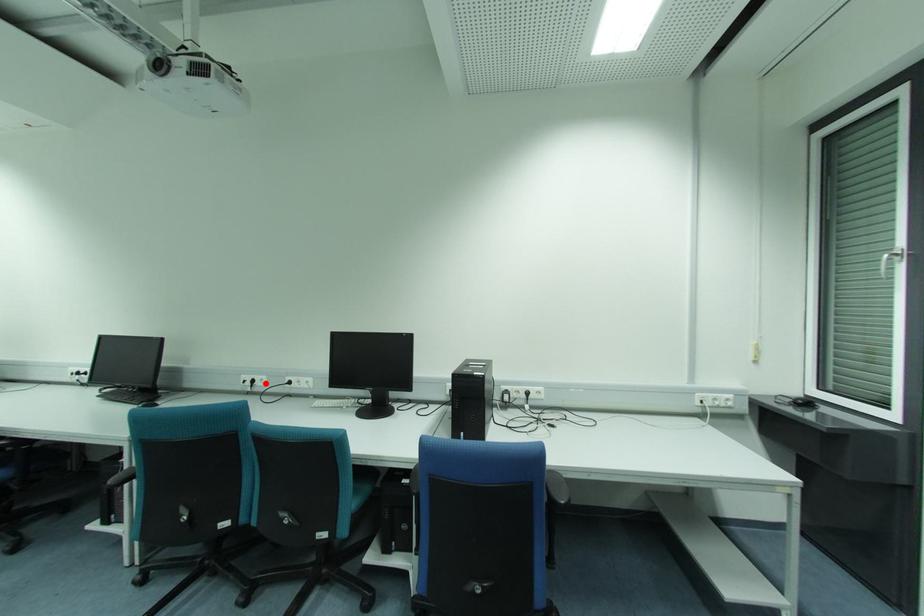
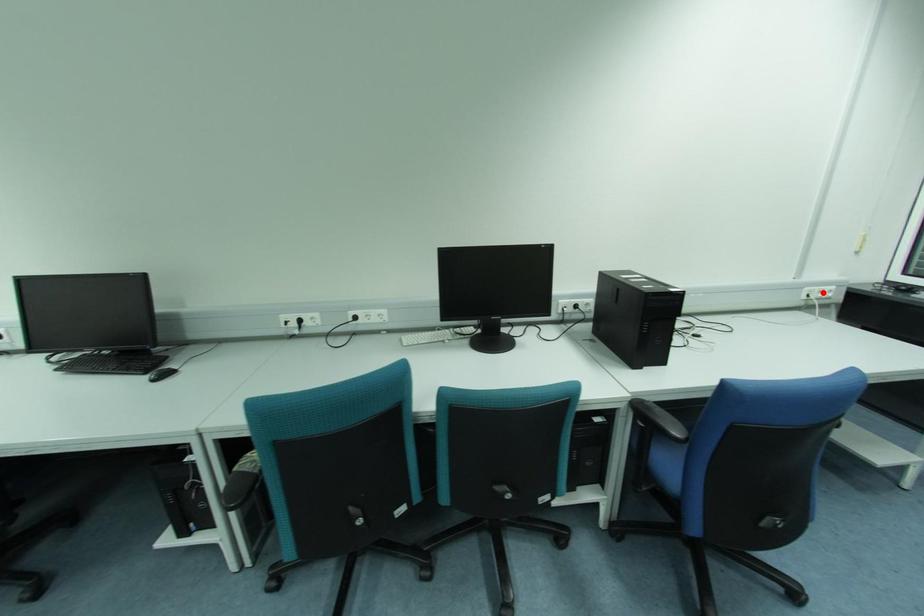
I am providing you with two images of the same scene from different viewpoints. A red point is marked on the first image and another point is marked on the second image. Are the points marked in image1 and image2 representing the same 3D position?

No